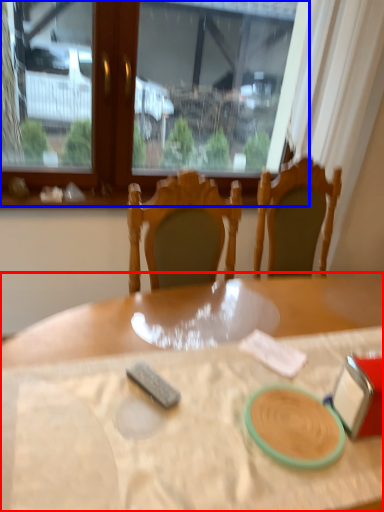
Question: Which object is closer to the camera taking this photo, table (highlighted by a red box) or window (highlighted by a blue box)?

Choices:
 (A) table
 (B) window

Answer: (A)